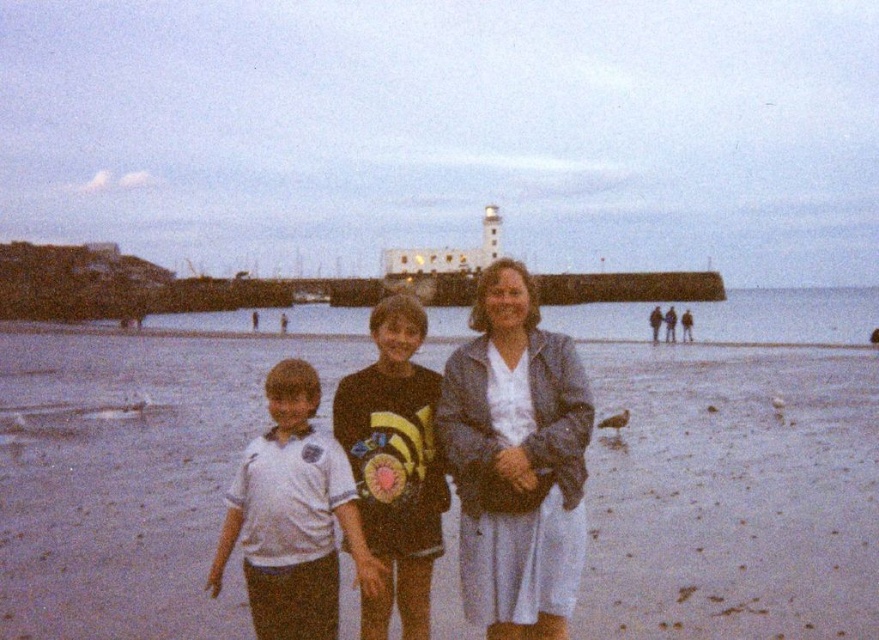
From the picture: You are planning to place a small beach umbrella between the white sand at center and the light blue fabric dress at center. Which object should the umbrella be closer to if it needs to be placed on the larger object?

The white sand at center is larger in size than the light blue fabric dress at center, so the umbrella should be placed closer to the white sand at center.

You are standing on the beach and want to know if the white cotton shirt at center and the matte gray jacket at center are within shouting distance of each other. Can you determine this based on their distance?

The white cotton shirt at center is 237.40 feet from matte gray jacket at center, which is approximately 72 meters. Since shouting distance is typically around 100 meters, they are within shouting distance of each other.